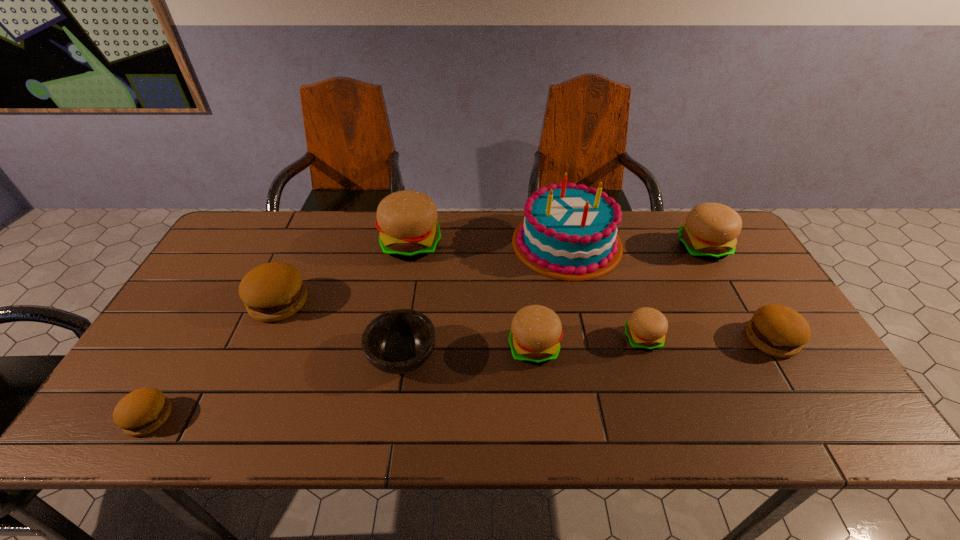
The width and height of the screenshot is (960, 540). Find the location of `the rightmost brown hamburger`. the rightmost brown hamburger is located at coordinates (777, 330).

At what (x,y) coordinates should I click in order to perform the action: click on the third hamburger from right to left. Please return your answer as a coordinate pair (x, y). Looking at the image, I should click on (646, 329).

Locate an element on the screen. the smallest beige hamburger is located at coordinates (646, 329).

The image size is (960, 540). In order to click on bowl in this screenshot , I will do `click(399, 341)`.

Where is `the leftmost brown hamburger`? the leftmost brown hamburger is located at coordinates (142, 411).

This screenshot has width=960, height=540. I want to click on the smallest brown hamburger, so click(142, 411).

What are the coordinates of `vacant space situated on the front of the blue birthday cake` in the screenshot? It's located at (588, 340).

Where is `vacant space located 0.240m on the left of the third hamburger from left to right`? This screenshot has width=960, height=540. vacant space located 0.240m on the left of the third hamburger from left to right is located at coordinates (305, 245).

At what (x,y) coordinates should I click in order to perform the action: click on vacant area located on the front of the rightmost beige hamburger. Please return your answer as a coordinate pair (x, y). This screenshot has width=960, height=540. Looking at the image, I should click on (734, 303).

Find the location of a particular element. The image size is (960, 540). vacant position located 0.280m on the right of the fourth hamburger from left to right is located at coordinates (670, 347).